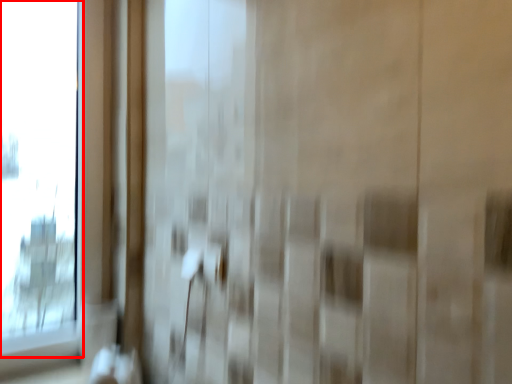
Question: From the image's perspective, what is the correct spatial positioning of window (annotated by the red box) in reference to door handle?

Choices:
 (A) above
 (B) below

Answer: (A)